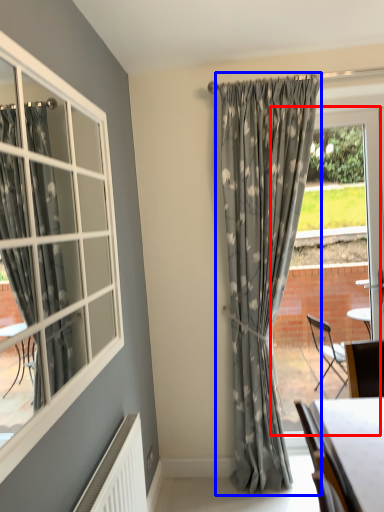
Question: Which point is closer to the camera, window frame (highlighted by a red box) or curtain (highlighted by a blue box)?

Choices:
 (A) window frame
 (B) curtain

Answer: (B)